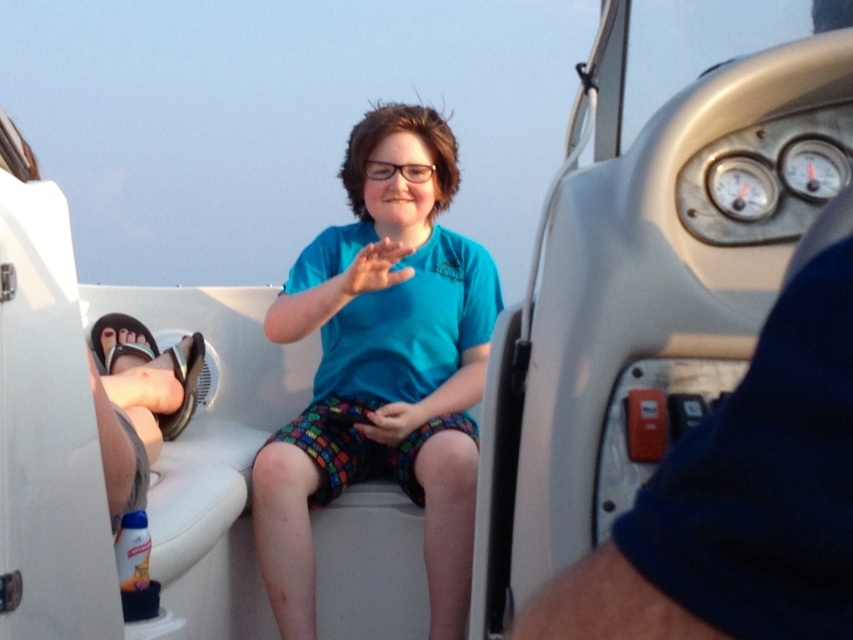
You are standing in the boat cabin and want to reach both points in the scene. Which point is closer to you, point (817, 253) or point (368, 252)?

Point (817, 253) is closer to the viewer than point (368, 252).

You are a photographer trying to capture the child in the boat cabin. You notice the teal fabric shirt at center and the multicolored fabric hand at center. Which object is located more to the left in the image?

The teal fabric shirt at center is positioned on the left side of the multicolored fabric hand at center, so the teal fabric shirt at center is more to the left.

You are a photographer trying to capture the child in the boat cabin. You need to ensure the teal fabric shirt at center and the multicolored fabric hand at center are both visible in the frame. Given their sizes, which object should you focus on to ensure both are in the shot?

The teal fabric shirt at center is larger in size than the multicolored fabric hand at center. To ensure both are visible, focus on the larger teal fabric shirt at center and position the camera so that the smaller multicolored fabric hand at center remains within the frame.